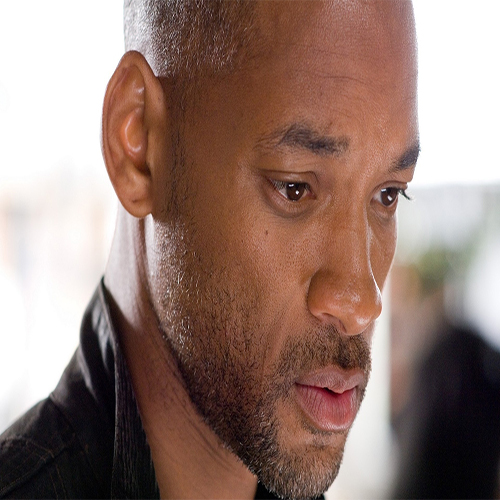
At what (x,y) coordinates should I click in order to perform the action: click on green shade. Please return your answer as a coordinate pair (x, y). The width and height of the screenshot is (500, 500). Looking at the image, I should click on (441, 262).